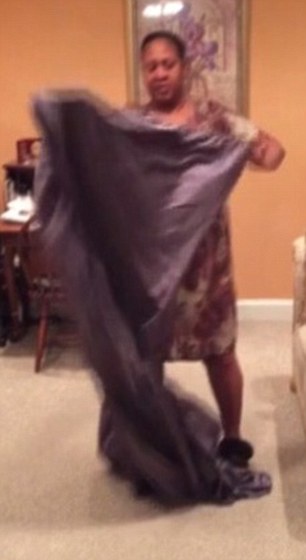
At what (x,y) coordinates should I click in order to perform the action: click on sheet. Please return your answer as a coordinate pair (x, y). Looking at the image, I should click on (130, 277).